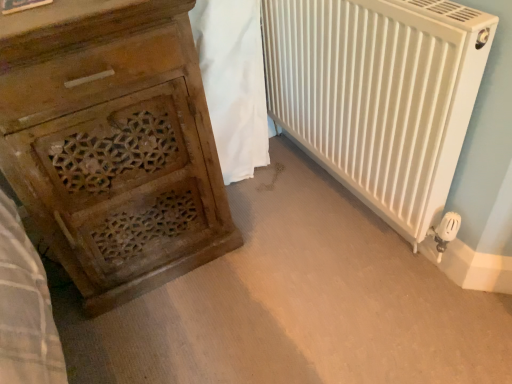
Question: Does white matte radiator at right have a lesser height compared to white fabric at center?

Choices:
 (A) yes
 (B) no

Answer: (A)

Question: From a real-world perspective, is white matte radiator at right over white fabric at center?

Choices:
 (A) yes
 (B) no

Answer: (A)

Question: Does white matte radiator at right have a larger size compared to white fabric at center?

Choices:
 (A) yes
 (B) no

Answer: (A)

Question: Does white matte radiator at right contain white fabric at center?

Choices:
 (A) no
 (B) yes

Answer: (A)

Question: From a real-world perspective, does white matte radiator at right sit lower than white fabric at center?

Choices:
 (A) yes
 (B) no

Answer: (B)

Question: In terms of width, does white matte radiator at right look wider or thinner when compared to white fabric at center?

Choices:
 (A) wide
 (B) thin

Answer: (B)

Question: Based on their positions, is white matte radiator at right located to the left or right of white fabric at center?

Choices:
 (A) right
 (B) left

Answer: (A)

Question: Is white matte radiator at right in front of or behind white fabric at center in the image?

Choices:
 (A) behind
 (B) front

Answer: (B)

Question: Considering the positions of white matte radiator at right and white fabric at center in the image, is white matte radiator at right taller or shorter than white fabric at center?

Choices:
 (A) short
 (B) tall

Answer: (A)

Question: Looking at their shapes, would you say white fabric at center is wider or thinner than wooden carved chest of drawers at left?

Choices:
 (A) wide
 (B) thin

Answer: (B)

Question: Based on their sizes in the image, would you say white fabric at center is bigger or smaller than wooden carved chest of drawers at left?

Choices:
 (A) big
 (B) small

Answer: (B)

Question: From their relative heights in the image, would you say white fabric at center is taller or shorter than wooden carved chest of drawers at left?

Choices:
 (A) tall
 (B) short

Answer: (B)

Question: From the image's perspective, is white fabric at center located above or below wooden carved chest of drawers at left?

Choices:
 (A) above
 (B) below

Answer: (A)

Question: In the image, is white fabric at center positioned in front of or behind white matte radiator at right?

Choices:
 (A) behind
 (B) front

Answer: (A)

Question: In terms of size, does white fabric at center appear bigger or smaller than white matte radiator at right?

Choices:
 (A) big
 (B) small

Answer: (B)